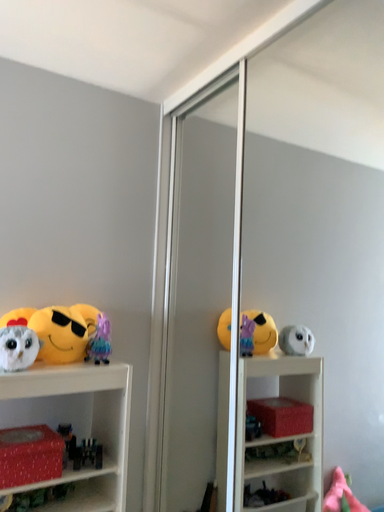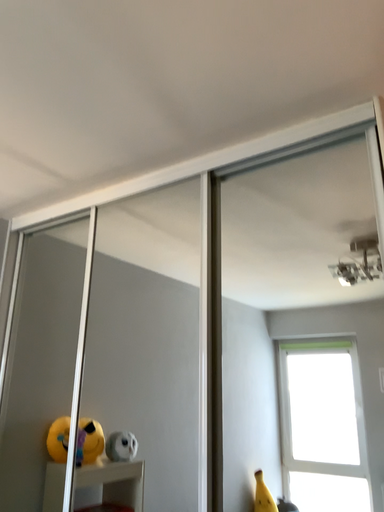
Question: How did the camera likely rotate when shooting the video?

Choices:
 (A) rotated upward
 (B) rotated downward

Answer: (A)